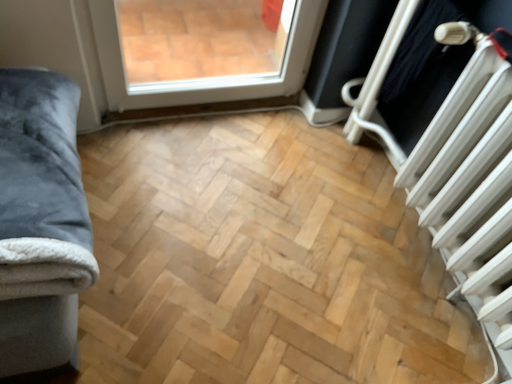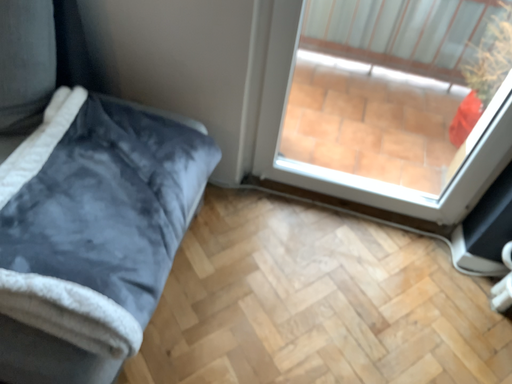
Question: Which way did the camera rotate in the video?

Choices:
 (A) rotated right
 (B) rotated left

Answer: (B)